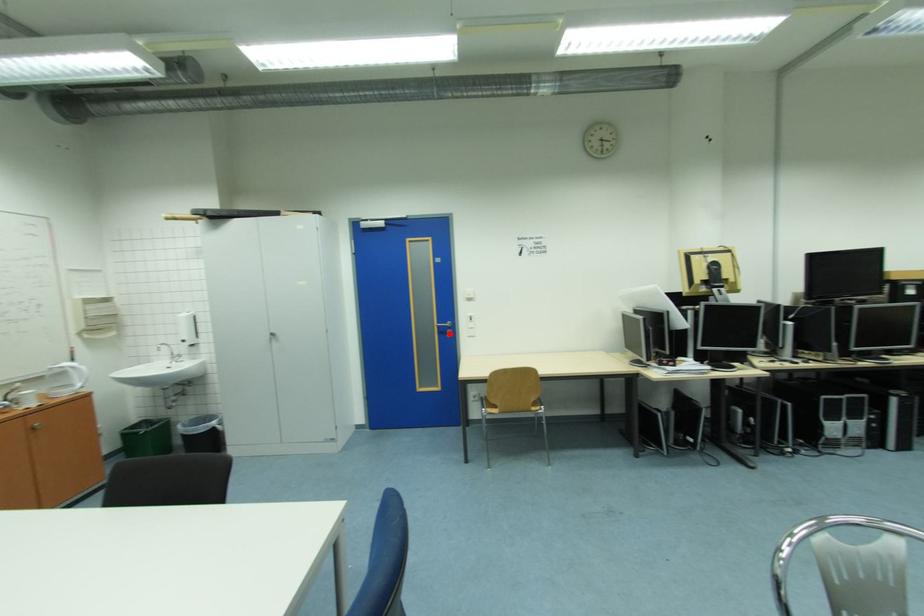
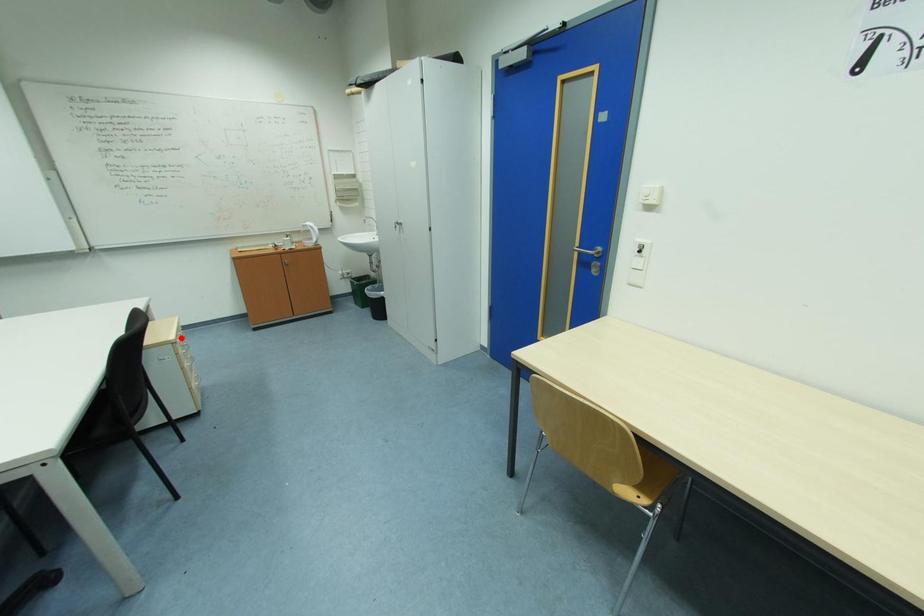
I am providing you with two images of the same scene from different viewpoints. A red point is marked on the first image and another point is marked on the second image. Are the points marked in image1 and image2 representing the same 3D position?

No